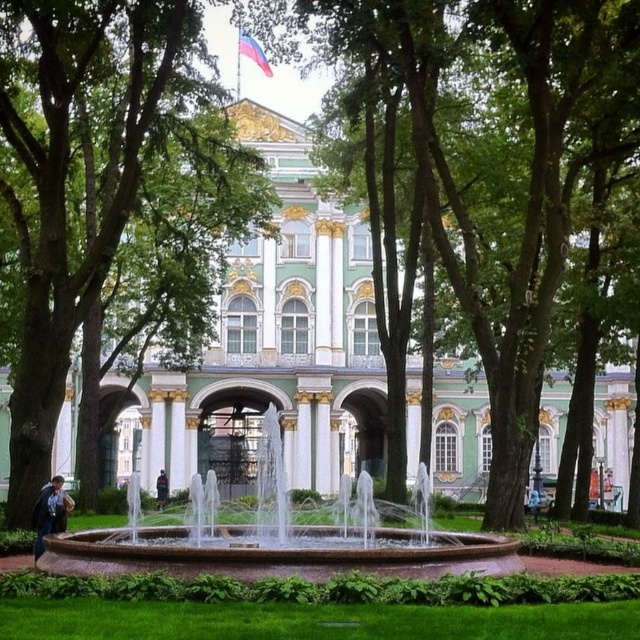
Can you confirm if green leafy tree at center is positioned to the left of dark blue jacket at center?

Indeed, green leafy tree at center is positioned on the left side of dark blue jacket at center.

Does green leafy tree at center appear under dark blue jacket at center?

Incorrect, green leafy tree at center is not positioned below dark blue jacket at center.

This screenshot has width=640, height=640. Describe the element at coordinates (112, 204) in the screenshot. I see `green leafy tree at center` at that location.

Locate an element on the screen. This screenshot has height=640, width=640. green leafy tree at center is located at coordinates (112, 204).

Can you confirm if green marble palace at center is positioned below denim jacket at lower left?

Actually, green marble palace at center is above denim jacket at lower left.

Between green marble palace at center and denim jacket at lower left, which one appears on the right side from the viewer's perspective?

From the viewer's perspective, green marble palace at center appears more on the right side.

You are a GUI agent. You are given a task and a screenshot of the screen. Output one action in this format:
    pyautogui.click(x=<x>, y=<y>)
    Task: Click on the green marble palace at center
    
    Given the screenshot: What is the action you would take?
    pyautogui.click(x=273, y=340)

Where is `green marble palace at center`? green marble palace at center is located at coordinates (273, 340).

Between white marble fountain at center and dark blue jacket at center, which one is positioned lower?

dark blue jacket at center is below.

Does point (84, 534) lie in front of point (164, 483)?

That is True.

At what (x,y) coordinates should I click in order to perform the action: click on white marble fountain at center. Please return your answer as a coordinate pair (x, y). This screenshot has width=640, height=640. Looking at the image, I should click on (278, 552).

At what (x,y) coordinates should I click in order to perform the action: click on white marble fountain at center. Please return your answer as a coordinate pair (x, y). Looking at the image, I should click on (278, 552).